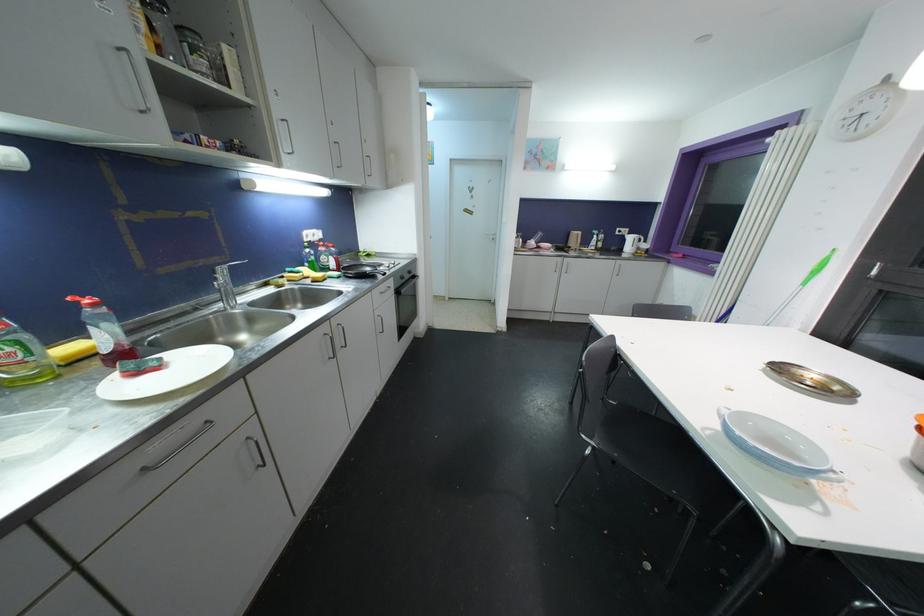
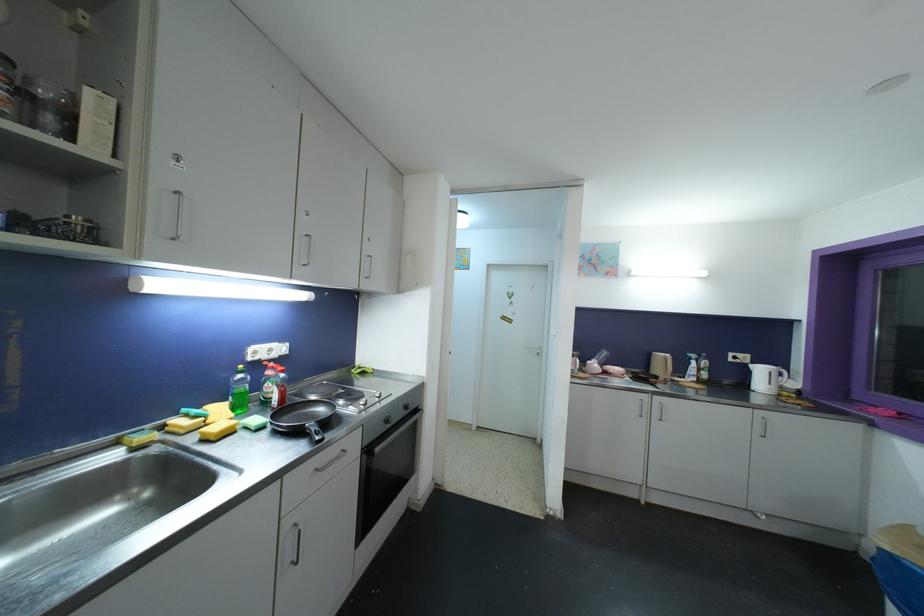
Where in the second image is the point corresponding to pixel 496 241 from the first image?

(542, 357)